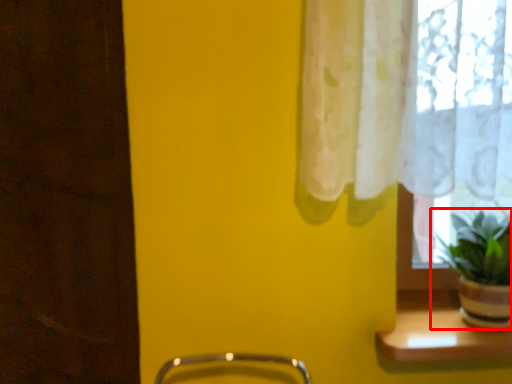
Question: Observing the image, what is the correct spatial positioning of houseplant (annotated by the red box) in reference to window sill?

Choices:
 (A) right
 (B) left

Answer: (A)